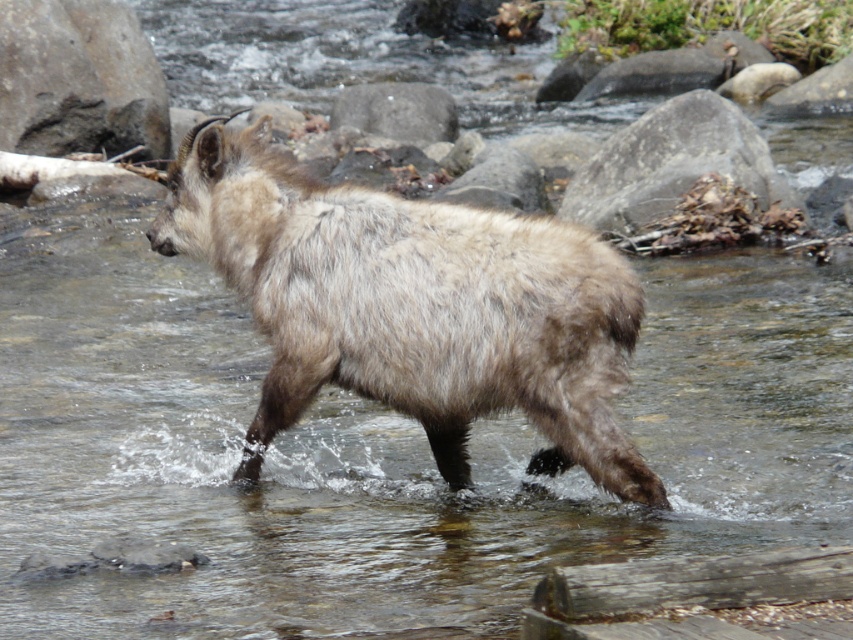
You are a hiker trying to cross the stream in the image. You see two rocks to step on, the gray rock at upper left and the gray rough rock at upper center. Which rock should you step on first if you want to reach the other side?

You should step on the gray rock at upper left first because it is closer to you than the gray rough rock at upper center.

You are a photographer trying to capture the fuzzy brown goat at center and the gray rock at center in the same frame. Based on their sizes, which one should you focus on first to ensure both are in focus?

The fuzzy brown goat at center is much taller than the gray rock at center, so focusing on the goat first will help ensure both are in focus since it is the larger subject.